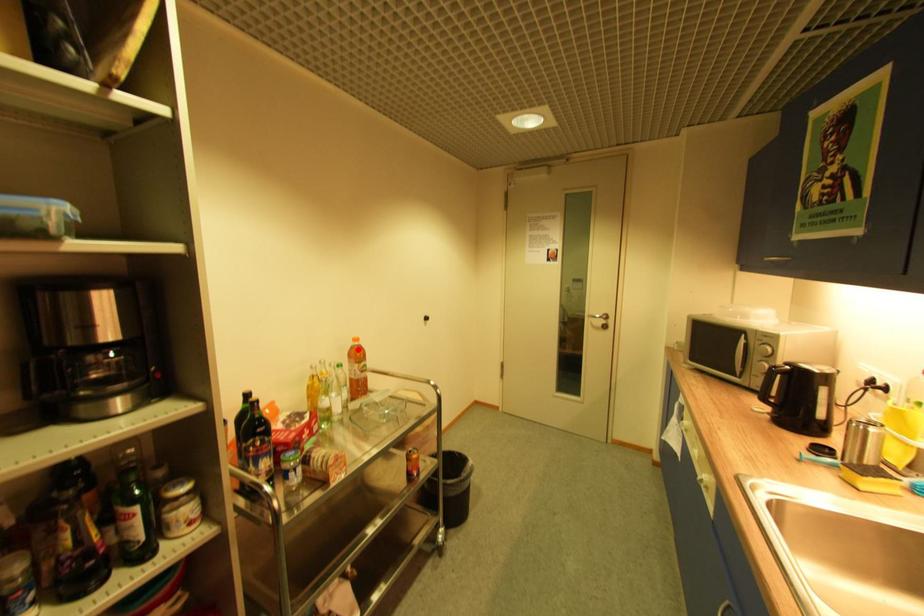
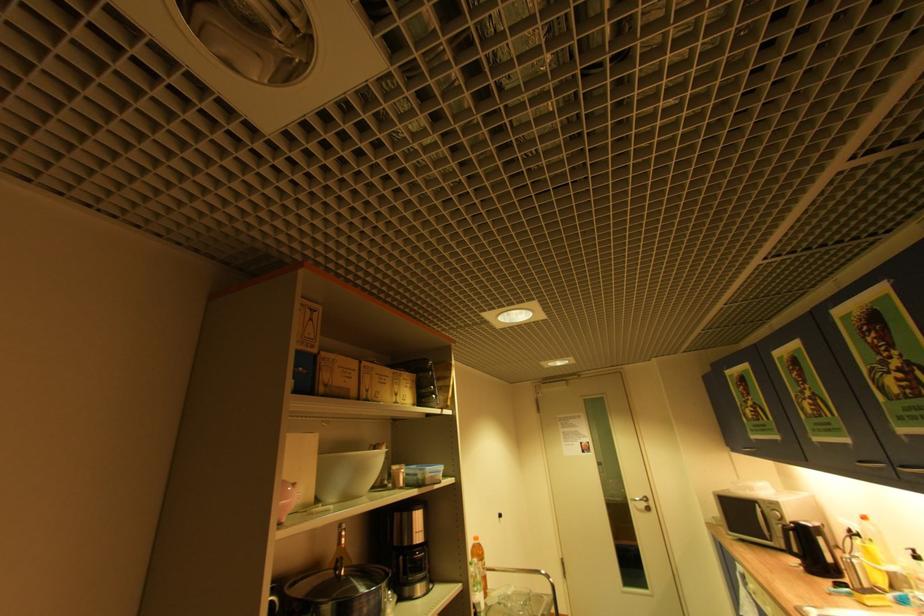
Question: I am providing you with two images of the same scene from different viewpoints. A red point is marked on the first image. Is the red point's position out of view in image 2?

Choices:
 (A) Yes
 (B) No

Answer: (B)